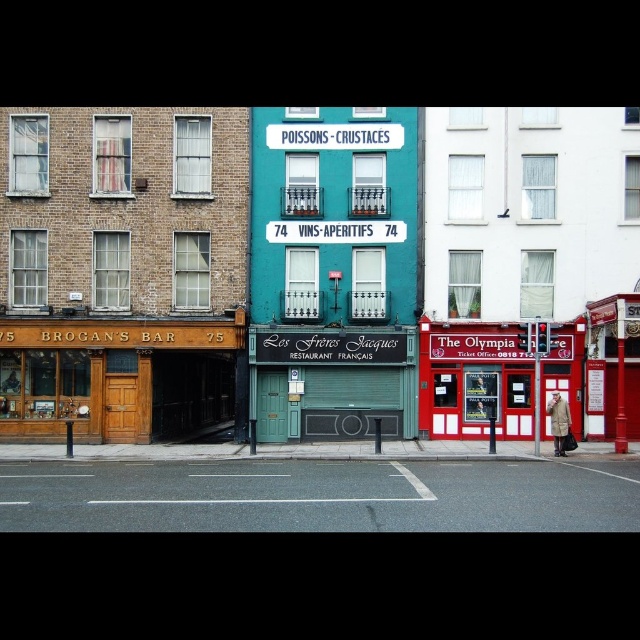
You are a tourist standing in front of the buildings. You notice the teal painted signboard at center and the red painted metal ticket booth at center. Which object is shorter?

The teal painted signboard at center is not as tall as the red painted metal ticket booth at center, so the teal painted signboard at center is shorter.